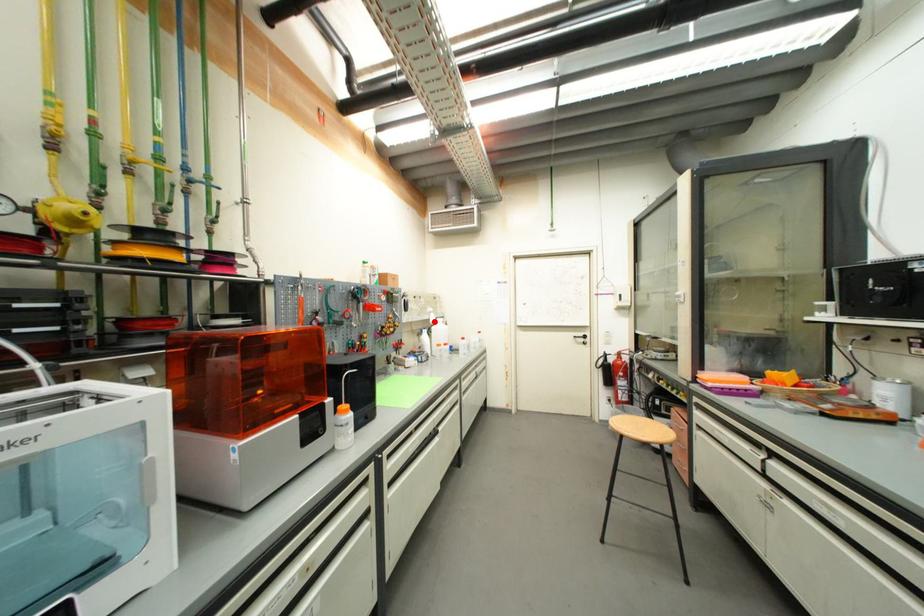
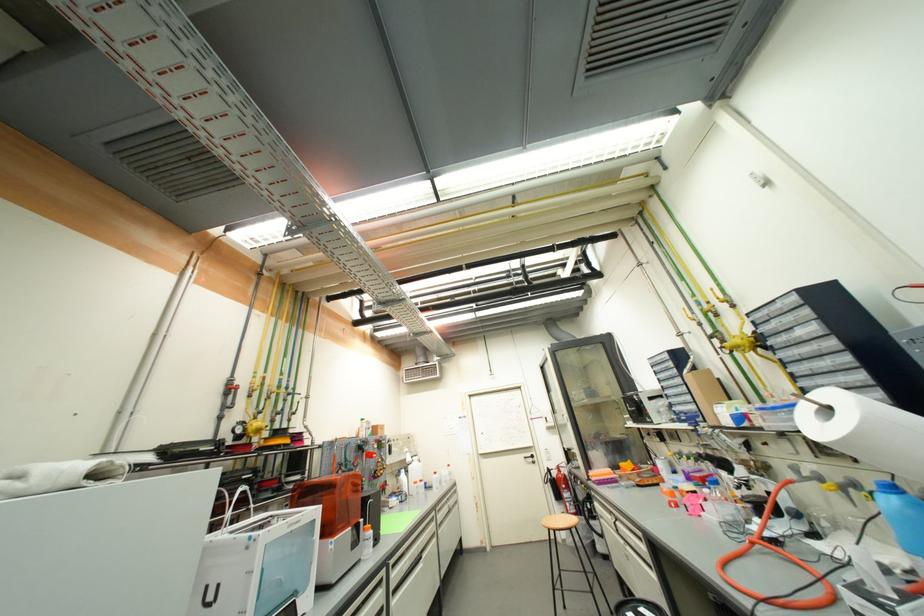
Where in the second image is the point corresponding to the highlighted location from the first image?

(410, 461)